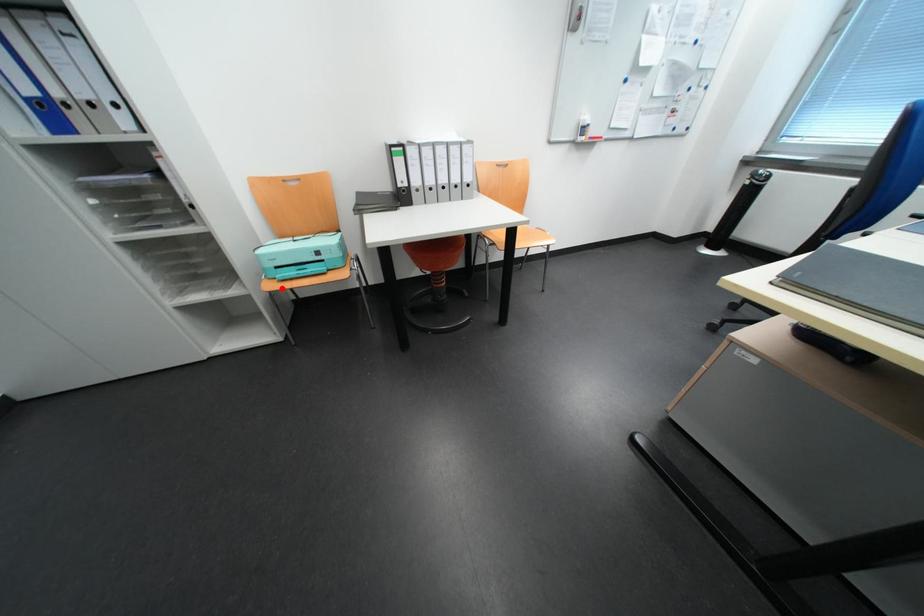
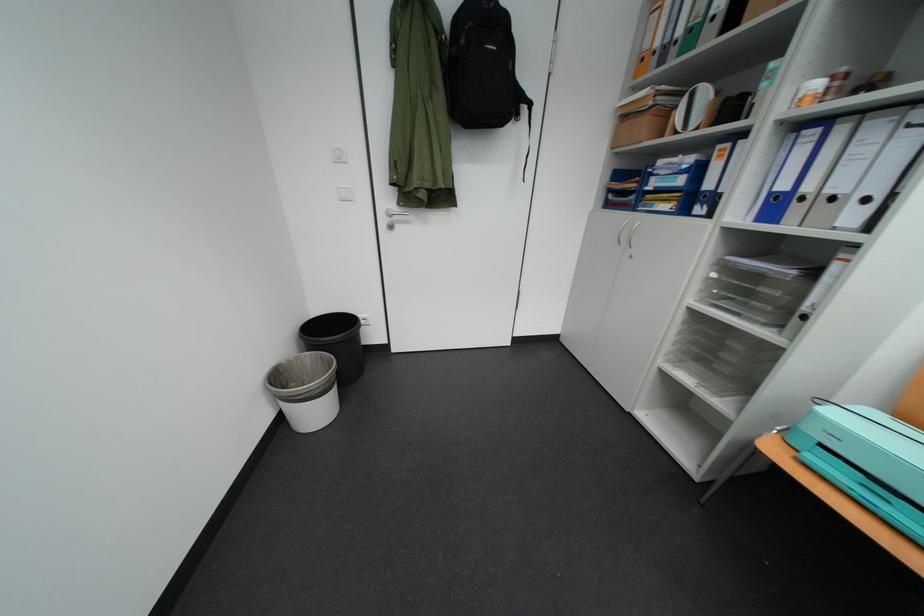
In the second image, find the point that corresponds to the highlighted location in the first image.

(784, 451)